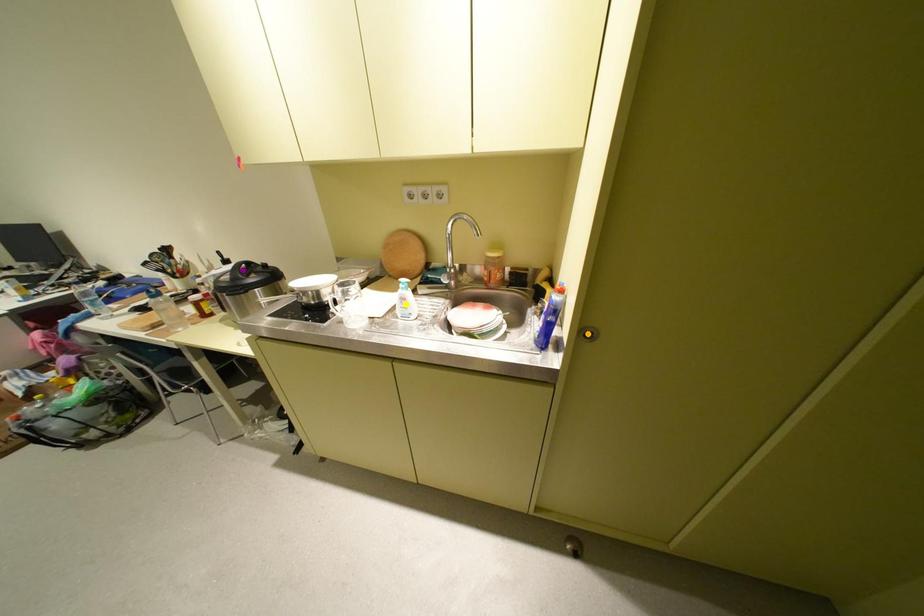
Order these from nearest to farthest:
purple point | yellow point | orange point

purple point, yellow point, orange point